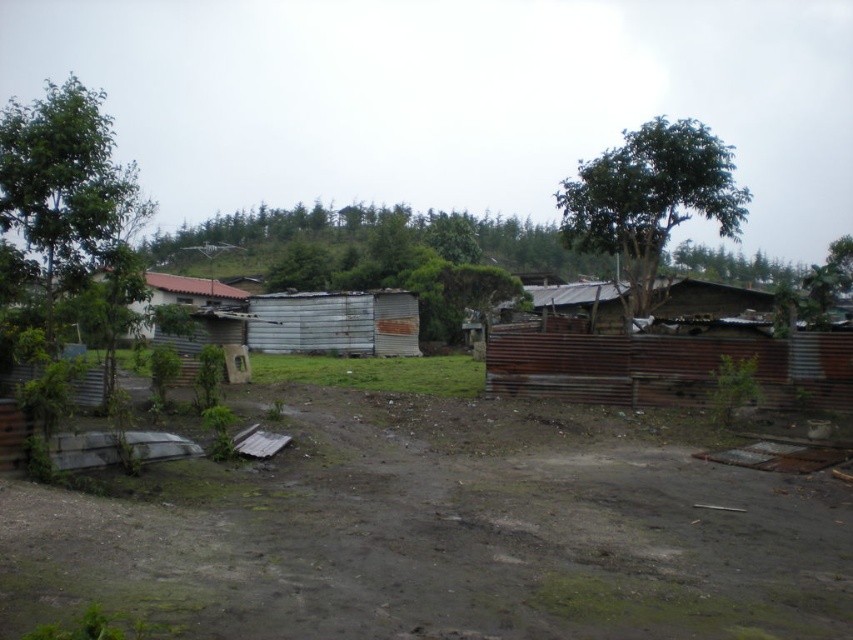
Question: Observing the image, what is the correct spatial positioning of dull brown dirt track at center in reference to green leafy tree at upper right?

Choices:
 (A) above
 (B) below

Answer: (B)

Question: Can you confirm if dull brown dirt track at center is bigger than green leafy tree at upper right?

Choices:
 (A) yes
 (B) no

Answer: (B)

Question: Which object is closer to the camera taking this photo?

Choices:
 (A) dull brown dirt track at center
 (B) green leafy tree at upper right

Answer: (A)

Question: Which of the following is the farthest from the observer?

Choices:
 (A) (693, 188)
 (B) (602, 435)

Answer: (A)

Question: Can you confirm if dull brown dirt track at center is positioned below green leafy tree at upper right?

Choices:
 (A) no
 (B) yes

Answer: (B)